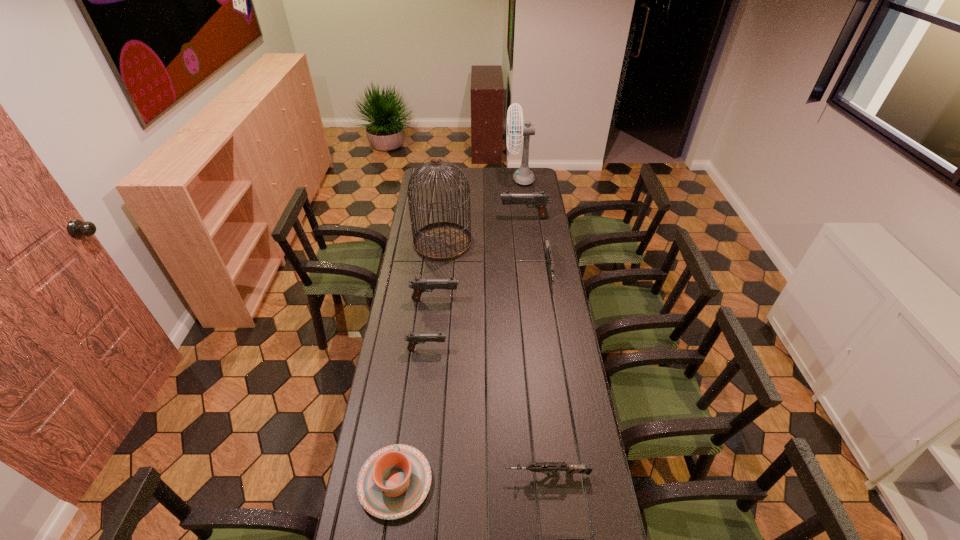
Locate an element on the screen. the farthest object is located at coordinates (524, 176).

What are the coordinates of `gray fan` in the screenshot? It's located at (524, 176).

This screenshot has width=960, height=540. I want to click on birdcage, so click(x=442, y=241).

Identify the location of the tallest gun. Image resolution: width=960 pixels, height=540 pixels. (539, 200).

Locate an element on the screen. The height and width of the screenshot is (540, 960). the third tallest object is located at coordinates (539, 200).

Where is `the fourth nearest gun`? Image resolution: width=960 pixels, height=540 pixels. the fourth nearest gun is located at coordinates [x=419, y=285].

This screenshot has width=960, height=540. I want to click on the fifth farthest object, so click(419, 285).

Locate an element on the screen. the third nearest gun is located at coordinates (413, 338).

Locate an element on the screen. This screenshot has width=960, height=540. the smallest gray gun is located at coordinates (413, 338).

You are a GUI agent. You are given a task and a screenshot of the screen. Output one action in this format:
    pyautogui.click(x=<x>, y=<y>)
    Task: Click on the biggest grey gun
    The height and width of the screenshot is (540, 960).
    Given the screenshot: What is the action you would take?
    pyautogui.click(x=546, y=240)